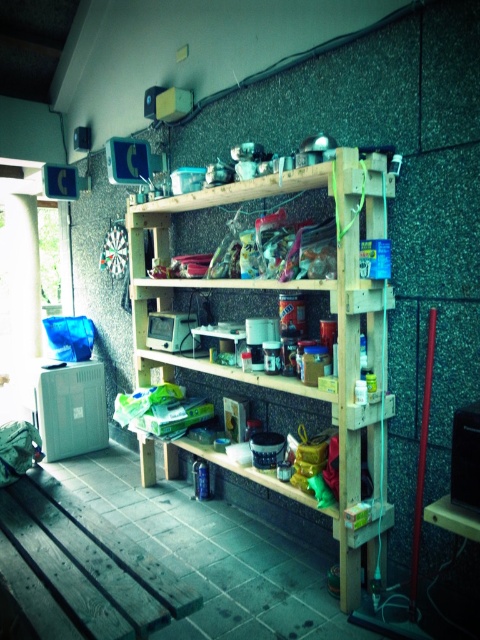
You are a delivery person who just arrived with a large box that is 2 meters long. You need to place it in the storage area shown in the image. Can you fit the box in front of the natural wood pantry at center without moving any existing items?

The distance between the natural wood pantry at center and the viewer is 2.01 meters. Since the box is 2 meters long, it can fit in front of the natural wood pantry at center as there is enough space.

In the scene shown: You are organizing the storage area and need to place a tall stack of boxes that requires a surface taller than 1.5 meters. Which object between the natural wood pantry at center and the dark wood workbench at lower left can accommodate this requirement?

The natural wood pantry at center has a greater height compared to the dark wood workbench at lower left, so it can accommodate the tall stack of boxes requiring a surface taller than 1.5 meters.

You are organizing the storage area and need to move items from the natural wood pantry at center to the dark wood workbench at lower left. Based on their positions, which object is higher up?

The natural wood pantry at center is located above the dark wood workbench at lower left, so it is higher up.